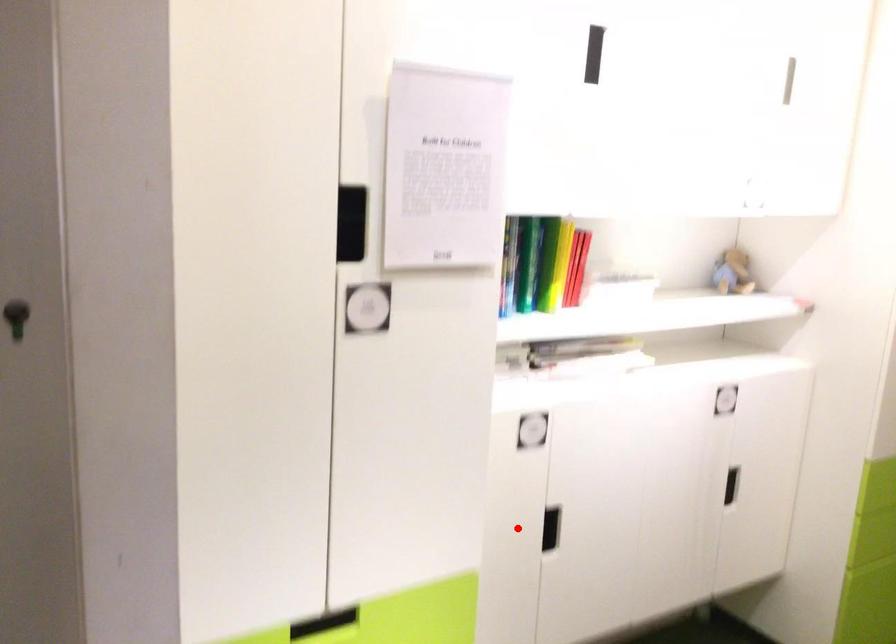
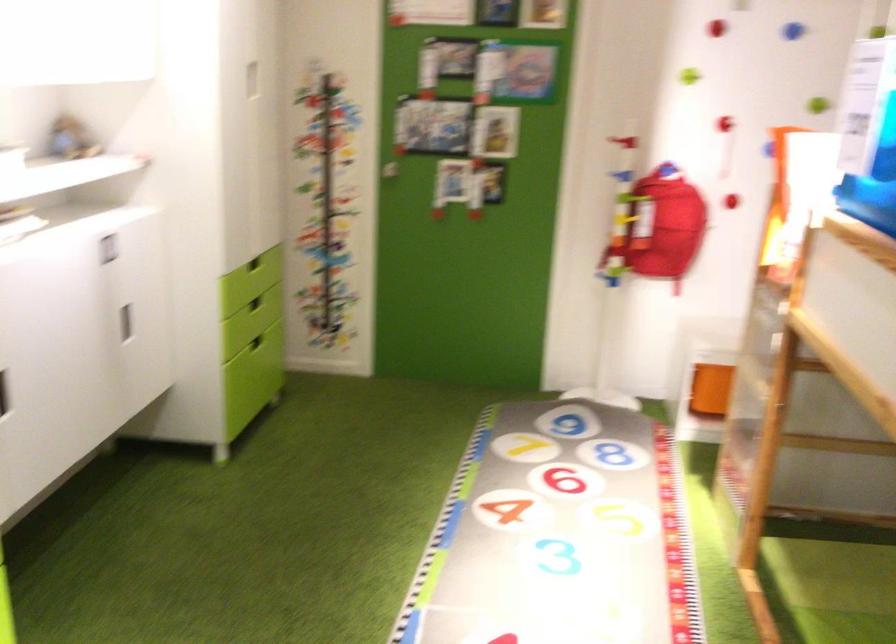
Find the pixel in the second image that matches the highlighted location in the first image.

(3, 393)